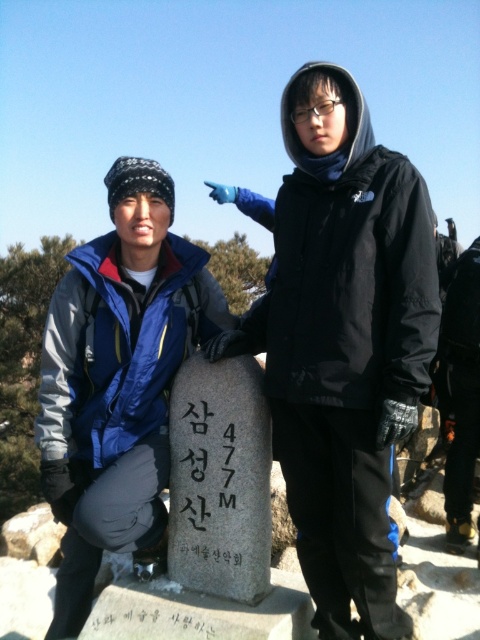
Who is positioned more to the left, gray stone at center or black stone marker at center?

black stone marker at center

Between gray stone at center and black stone marker at center, which one is positioned lower?

black stone marker at center

What do you see at coordinates (219, 480) in the screenshot? I see `gray stone at center` at bounding box center [219, 480].

Locate an element on the screen. gray stone at center is located at coordinates (219, 480).

Can you confirm if blue fleece jacket at lower left is bigger than black stone sign at center?

Indeed, blue fleece jacket at lower left has a larger size compared to black stone sign at center.

Who is positioned more to the right, blue fleece jacket at lower left or black stone sign at center?

Positioned to the right is black stone sign at center.

You are a GUI agent. You are given a task and a screenshot of the screen. Output one action in this format:
    pyautogui.click(x=<x>, y=<y>)
    Task: Click on the blue fleece jacket at lower left
    This screenshot has height=640, width=480.
    Given the screenshot: What is the action you would take?
    pyautogui.click(x=118, y=380)

I want to click on blue fleece jacket at lower left, so click(x=118, y=380).

Can you confirm if black stone sign at center is shorter than black stone marker at center?

Incorrect, black stone sign at center's height does not fall short of black stone marker at center's.

Is black stone sign at center smaller than black stone marker at center?

No.

Is point (196, 454) positioned behind point (225, 630)?

That is True.

Where is `black stone sign at center`? The image size is (480, 640). black stone sign at center is located at coordinates (208, 477).